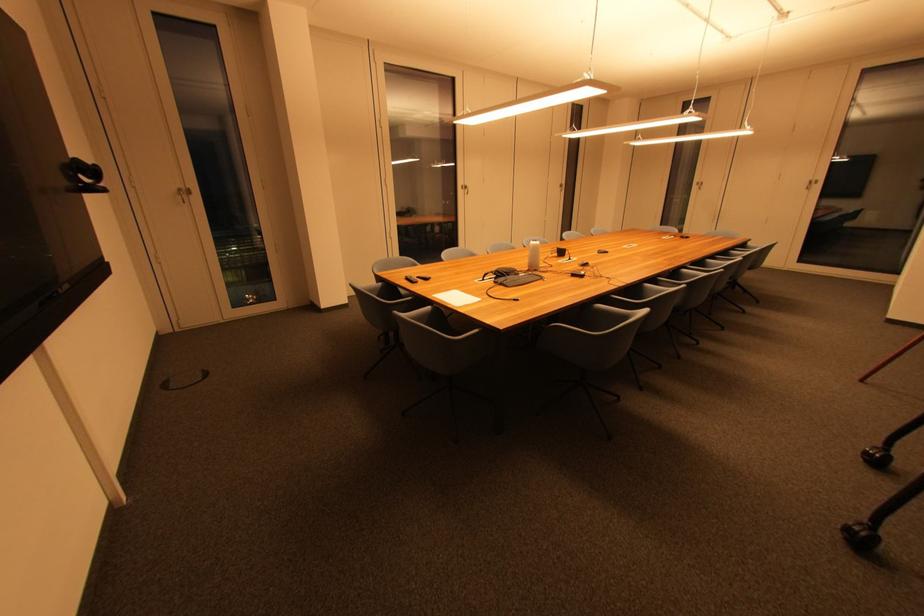
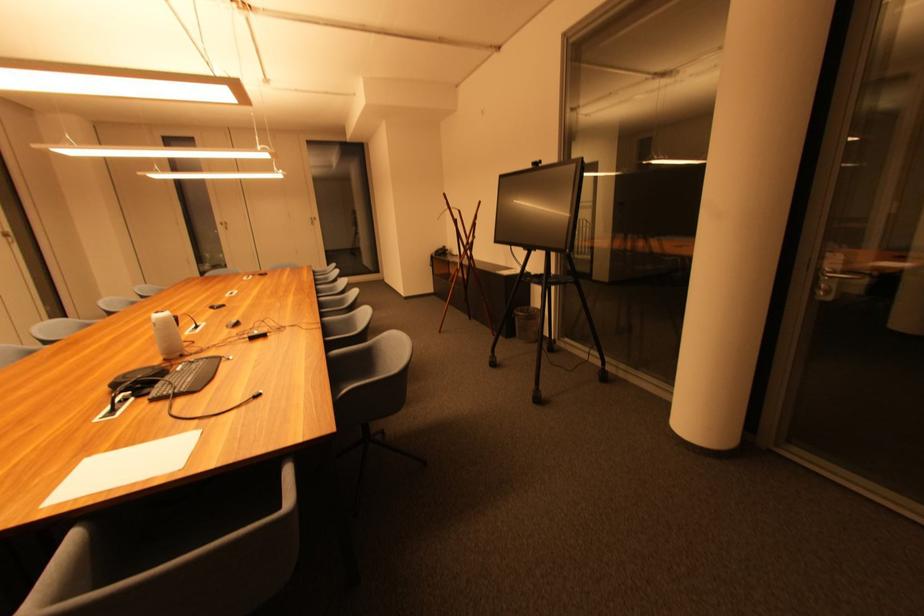
Locate, in the second image, the point that corresponds to the point at 538,244 in the first image.

(160, 318)